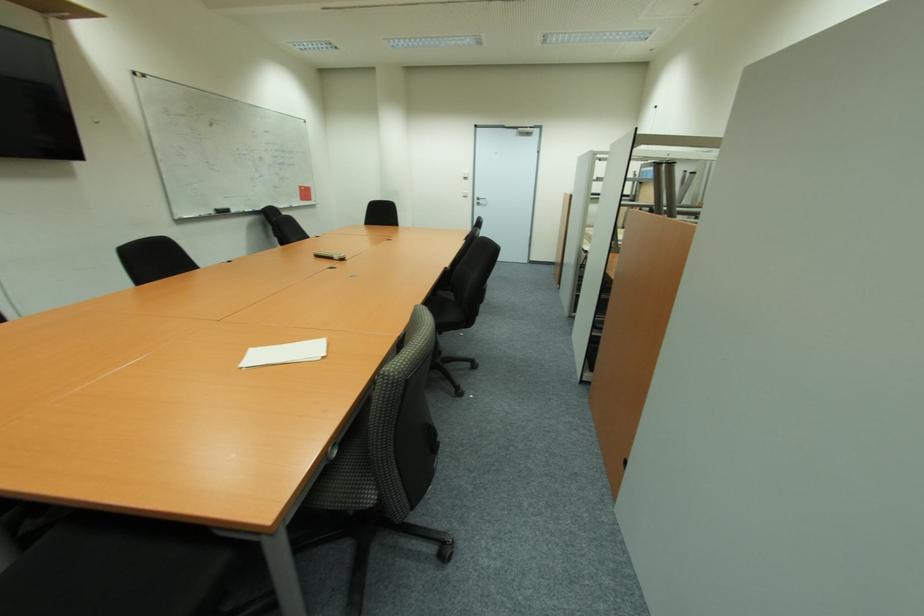
Locate an element on the screen. The image size is (924, 616). white light switch is located at coordinates (467, 193).